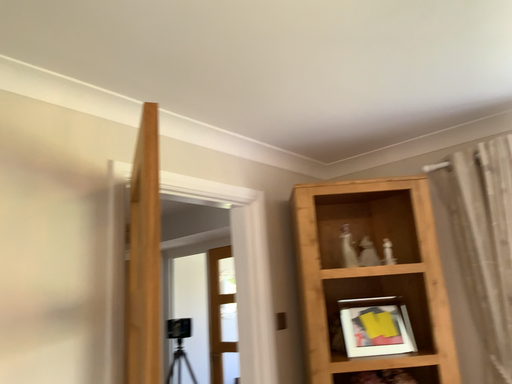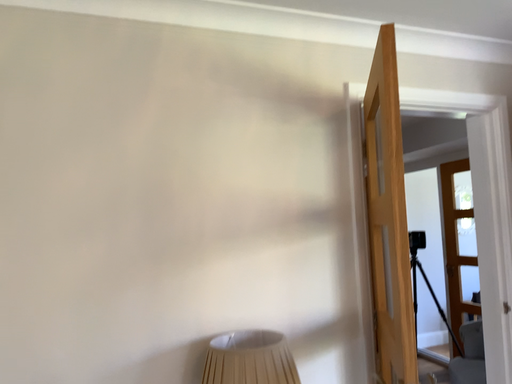
Question: Which way did the camera rotate in the video?

Choices:
 (A) rotated right
 (B) rotated left

Answer: (B)